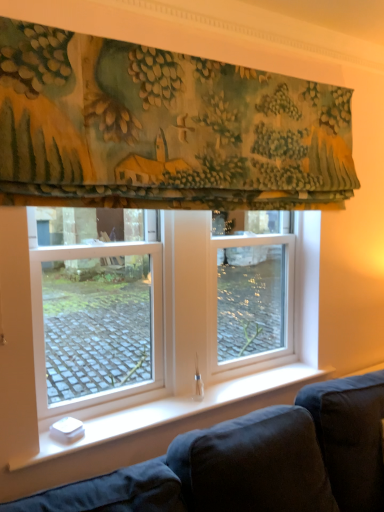
Question: Does clear glass window at center have a larger size compared to textured green fabric at upper center?

Choices:
 (A) no
 (B) yes

Answer: (A)

Question: Does clear glass window at center have a lesser width compared to textured green fabric at upper center?

Choices:
 (A) no
 (B) yes

Answer: (B)

Question: Is clear glass window at center at the right side of textured green fabric at upper center?

Choices:
 (A) yes
 (B) no

Answer: (B)

Question: Does clear glass window at center lie in front of textured green fabric at upper center?

Choices:
 (A) no
 (B) yes

Answer: (A)

Question: Is clear glass window at center to the left of textured green fabric at upper center from the viewer's perspective?

Choices:
 (A) no
 (B) yes

Answer: (B)

Question: From a real-world perspective, is clear glass window at center positioned over textured green fabric at upper center based on gravity?

Choices:
 (A) yes
 (B) no

Answer: (B)

Question: Is dark blue fabric couch at lower left positioned before clear glass window at center?

Choices:
 (A) yes
 (B) no

Answer: (A)

Question: From the image's perspective, is dark blue fabric couch at lower left located beneath clear glass window at center?

Choices:
 (A) yes
 (B) no

Answer: (A)

Question: Considering the relative sizes of dark blue fabric couch at lower left and clear glass window at center in the image provided, is dark blue fabric couch at lower left wider than clear glass window at center?

Choices:
 (A) no
 (B) yes

Answer: (B)

Question: Considering the relative sizes of dark blue fabric couch at lower left and clear glass window at center in the image provided, is dark blue fabric couch at lower left thinner than clear glass window at center?

Choices:
 (A) no
 (B) yes

Answer: (A)

Question: Is dark blue fabric couch at lower left looking in the opposite direction of clear glass window at center?

Choices:
 (A) yes
 (B) no

Answer: (B)

Question: Would you say clear glass window at center is part of dark blue fabric couch at lower left's contents?

Choices:
 (A) yes
 (B) no

Answer: (B)

Question: Can you confirm if textured green fabric at upper center is wider than dark blue fabric couch at lower left?

Choices:
 (A) yes
 (B) no

Answer: (A)